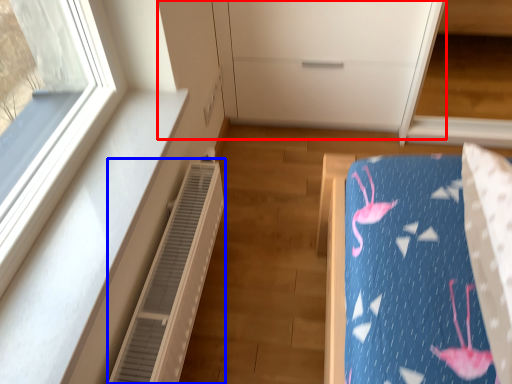
Question: Which of the following is the farthest to the observer, dresser (highlighted by a red box) or air conditioner (highlighted by a blue box)?

Choices:
 (A) dresser
 (B) air conditioner

Answer: (A)